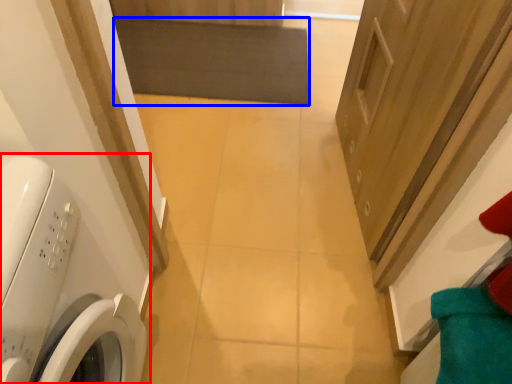
Question: Among these objects, which one is nearest to the camera, washing machine (highlighted by a red box) or mat (highlighted by a blue box)?

Choices:
 (A) washing machine
 (B) mat

Answer: (A)